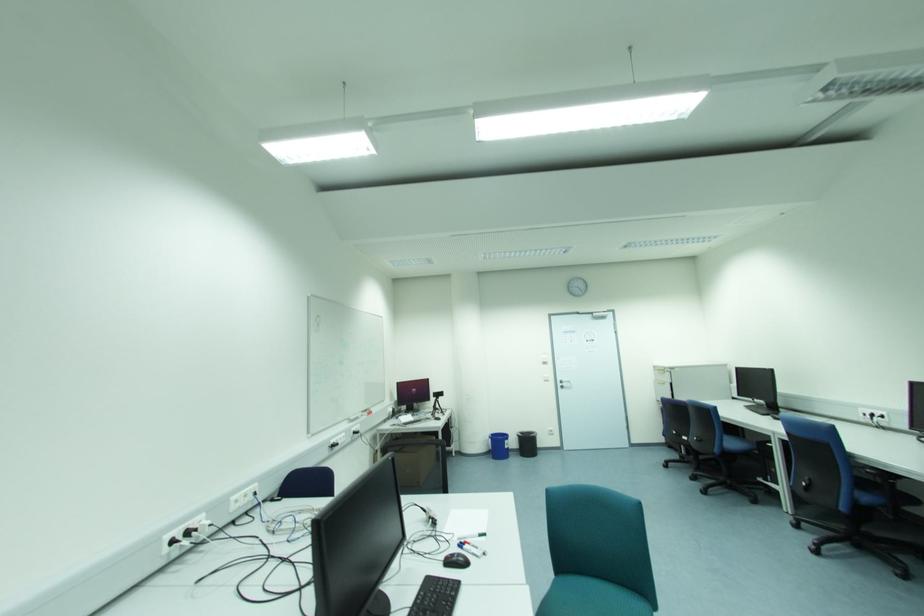
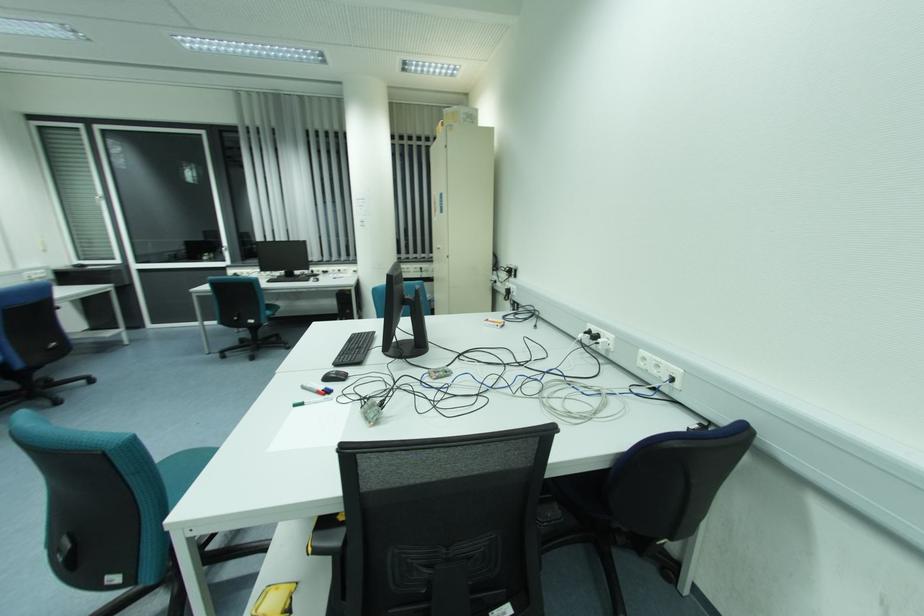
Find the pixel in the second image that matches point (485, 535) in the first image.

(296, 406)